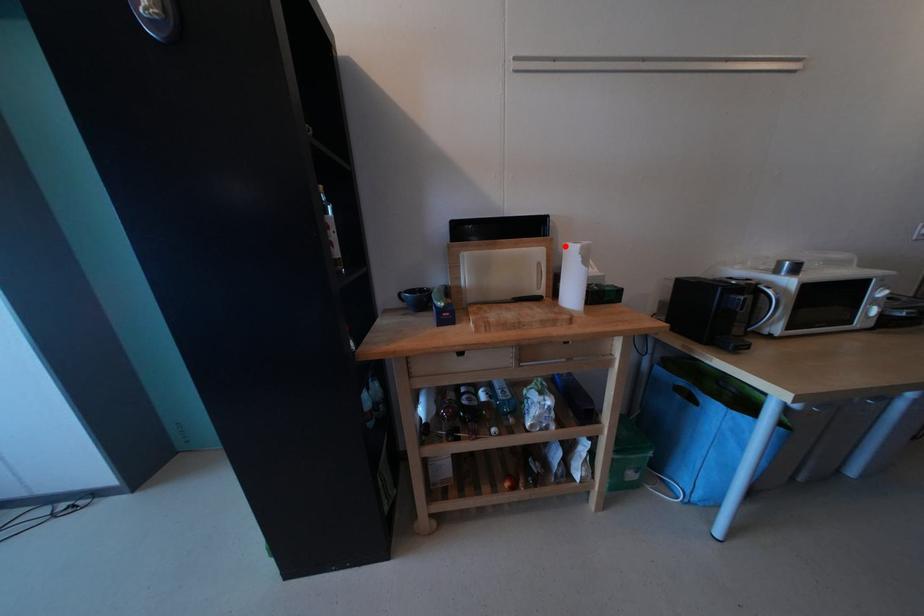
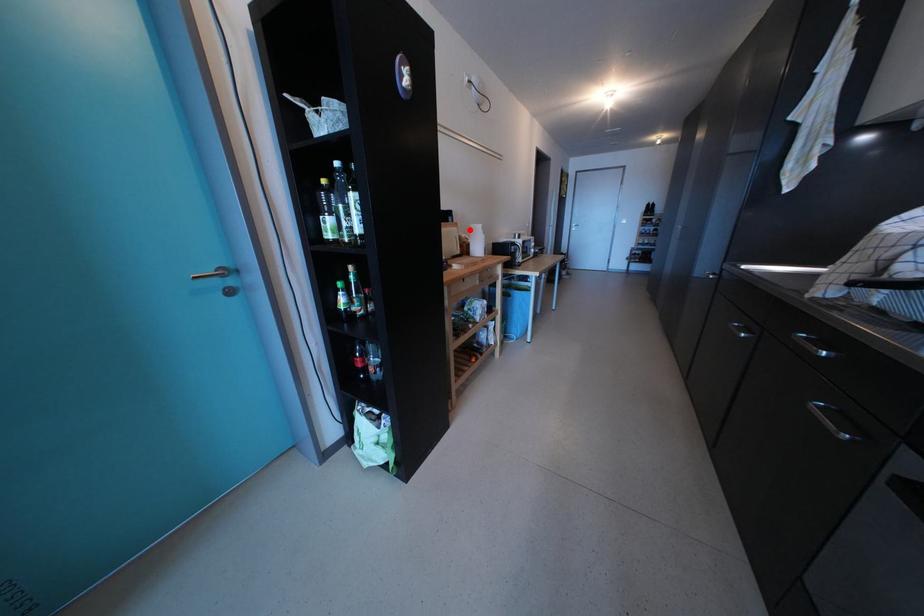
I am providing you with two images of the same scene from different viewpoints. A red point is marked on the first image and another point is marked on the second image. Are the points marked in image1 and image2 representing the same 3D position?

Yes